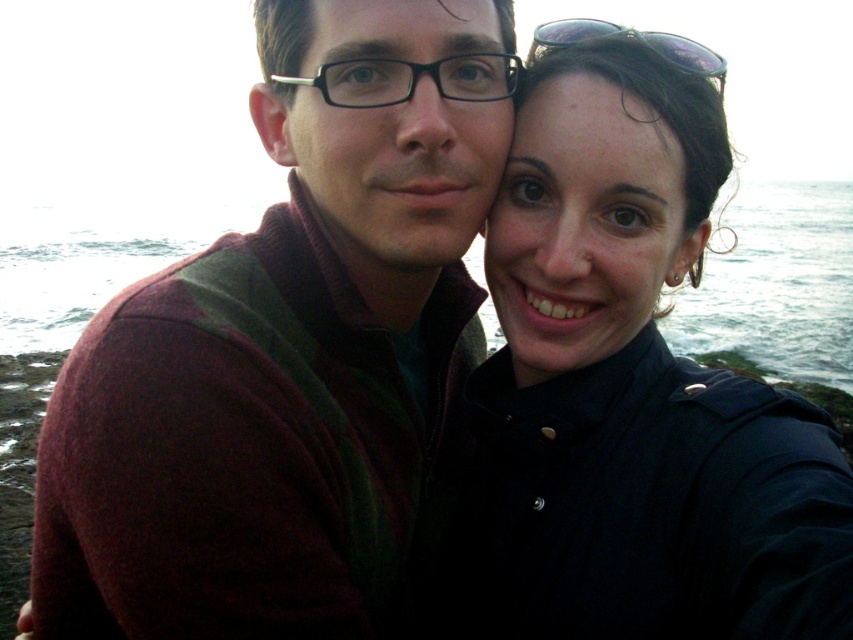
The height and width of the screenshot is (640, 853). I want to click on maroon sweater at left, so click(286, 348).

Can you confirm if maroon sweater at left is positioned below matte black shirt at center?

Actually, maroon sweater at left is above matte black shirt at center.

The height and width of the screenshot is (640, 853). Identify the location of maroon sweater at left. (286, 348).